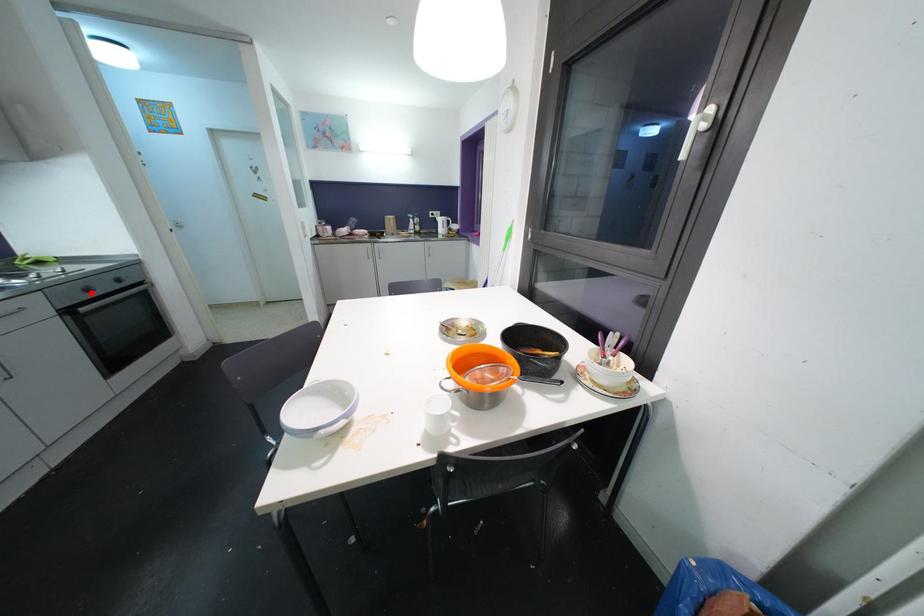
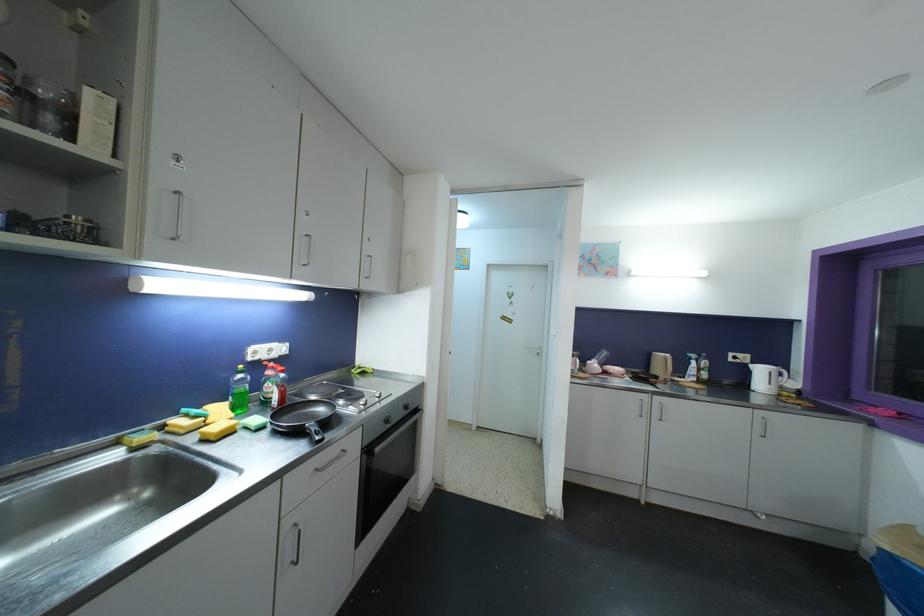
Find the pixel in the second image that matches the highlighted location in the first image.

(390, 424)